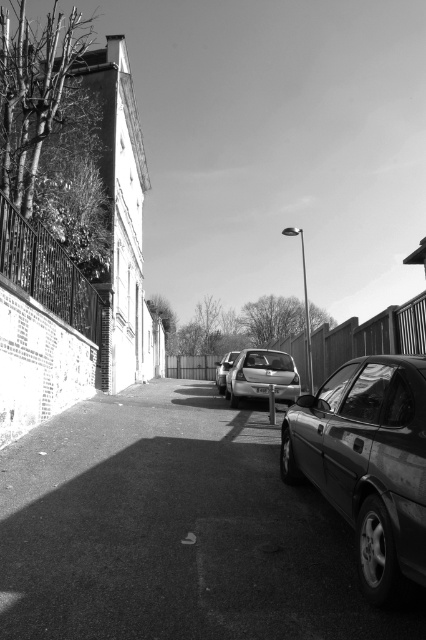
Between point (249, 440) and point (367, 592), which one is positioned behind?

Positioned behind is point (249, 440).

Locate an element on the screen. smooth asphalt road at center is located at coordinates (172, 529).

Is point (419, 448) positioned after point (218, 369)?

No, (419, 448) is closer to viewer.

Does point (414, 440) come in front of point (224, 387)?

Yes, it is in front of point (224, 387).

Locate an element on the screen. This screenshot has height=640, width=426. shiny metallic car at right is located at coordinates (368, 464).

Does shiny metallic car at right appear on the right side of metallic silver car at center?

Incorrect, shiny metallic car at right is not on the right side of metallic silver car at center.

Who is higher up, shiny metallic car at right or metallic silver car at center?

Positioned higher is metallic silver car at center.

Image resolution: width=426 pixels, height=640 pixels. What do you see at coordinates (368, 464) in the screenshot?
I see `shiny metallic car at right` at bounding box center [368, 464].

Locate an element on the screen. shiny metallic car at right is located at coordinates (368, 464).